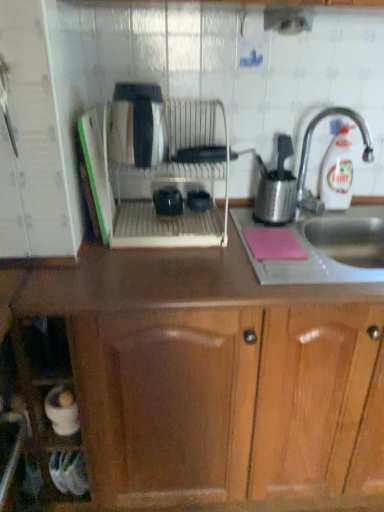
Identify the location of unoccupied area in front of satin silver dish rack at center. (163, 272).